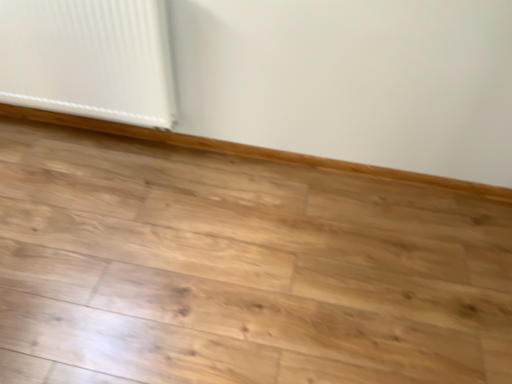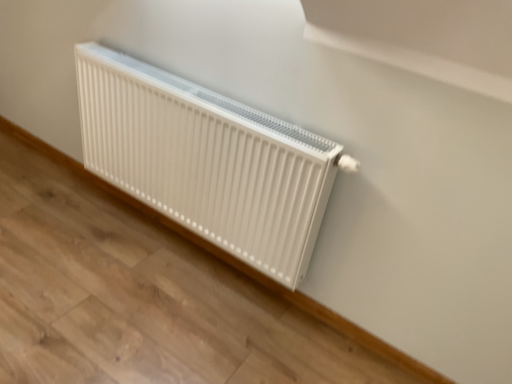
Question: How did the camera likely rotate when shooting the video?

Choices:
 (A) rotated right
 (B) rotated left

Answer: (B)